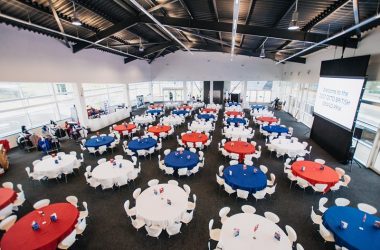
The image size is (380, 250). I want to click on blue tables, so click(x=155, y=110), click(x=186, y=110), click(x=274, y=128), click(x=239, y=120), click(x=206, y=115), click(x=241, y=174), click(x=187, y=158), click(x=127, y=141), click(x=108, y=140), click(x=330, y=218).